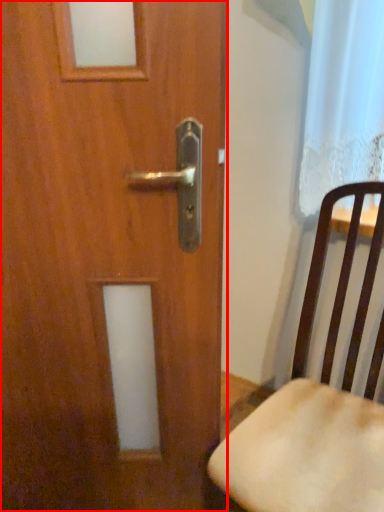
Question: Observing the image, what is the correct spatial positioning of door (annotated by the red box) in reference to chair?

Choices:
 (A) right
 (B) left

Answer: (B)